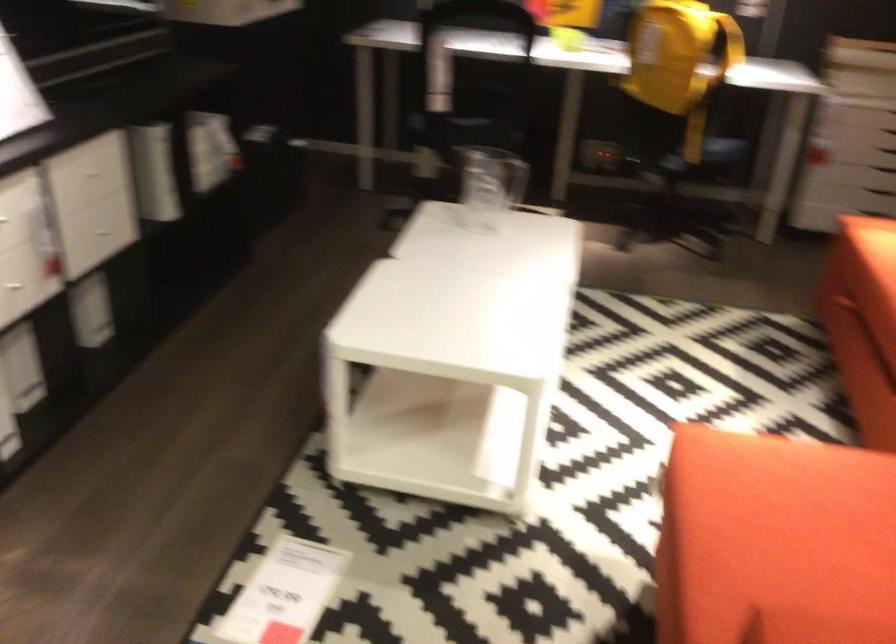
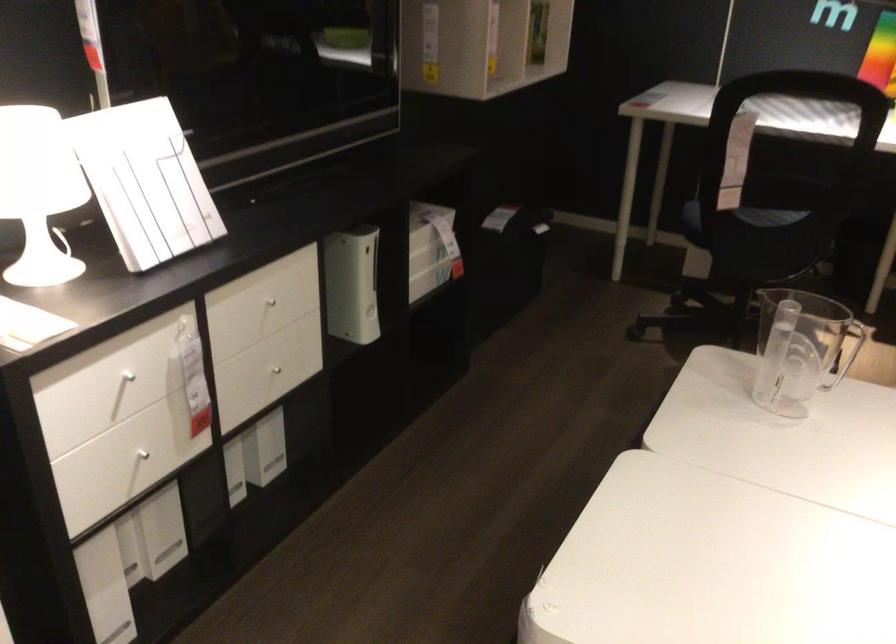
Locate, in the second image, the point that corresponds to point (97, 176) in the first image.

(271, 299)